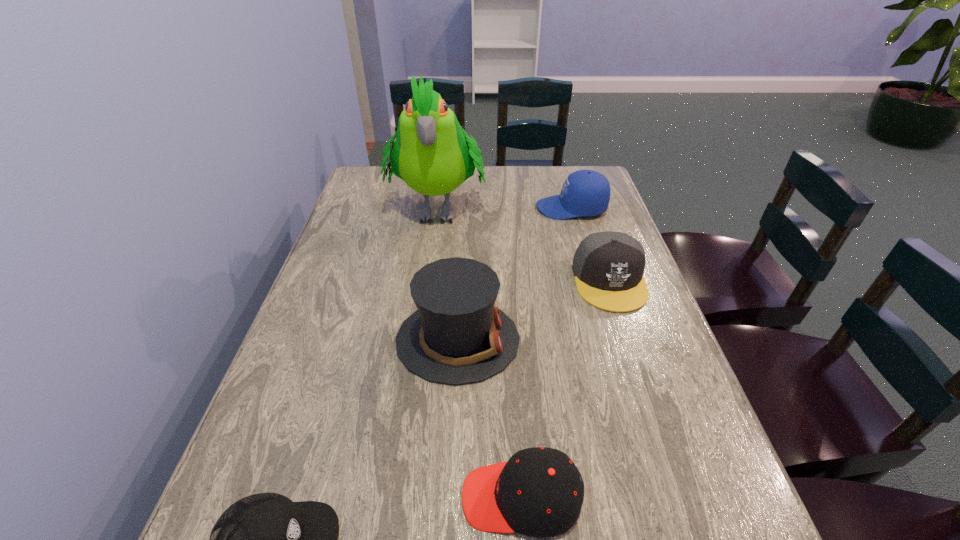
Identify the location of vacant space that is in between the farthest cap and the dress hat. This screenshot has height=540, width=960. (515, 274).

Find the location of a particular element. vacant space in between the dress hat and the third nearest cap is located at coordinates (534, 310).

Locate an element on the screen. object that is the closest one to the second tallest object is located at coordinates (539, 492).

Locate which object ranks in proximity to the dress hat. Please provide its 2D coordinates. Your answer should be formatted as a tuple, i.e. [(x, y)], where the tuple contains the x and y coordinates of a point satisfying the conditions above.

[(539, 492)]

Point out which cap is positioned as the third nearest to the leftmost cap. Please provide its 2D coordinates. Your answer should be formatted as a tuple, i.e. [(x, y)], where the tuple contains the x and y coordinates of a point satisfying the conditions above.

[(586, 193)]

Where is `the third closest cap relative to the leftmost cap`? This screenshot has width=960, height=540. the third closest cap relative to the leftmost cap is located at coordinates (586, 193).